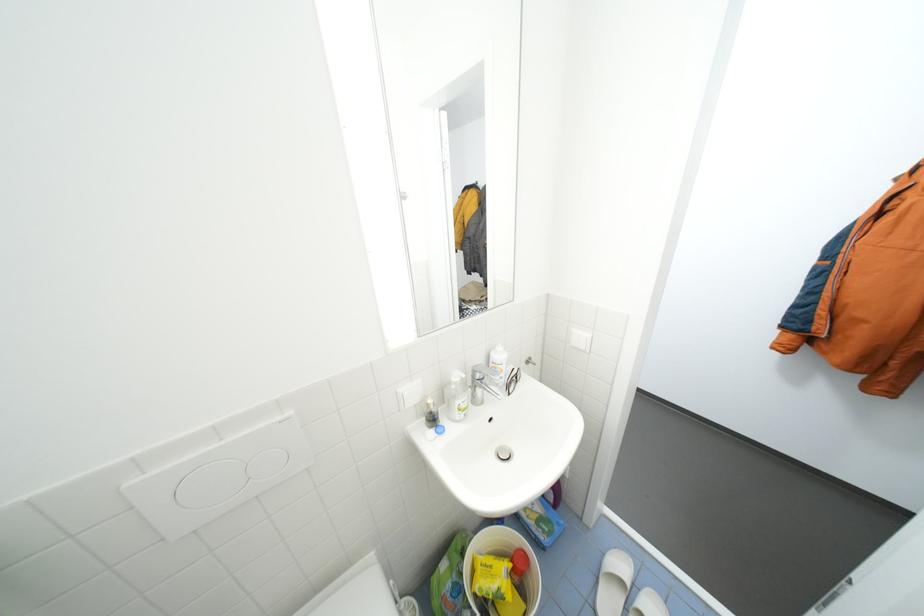
Find where to push the small flush button. Please return your answer as a coordinate pair (x, y).

(277, 456)